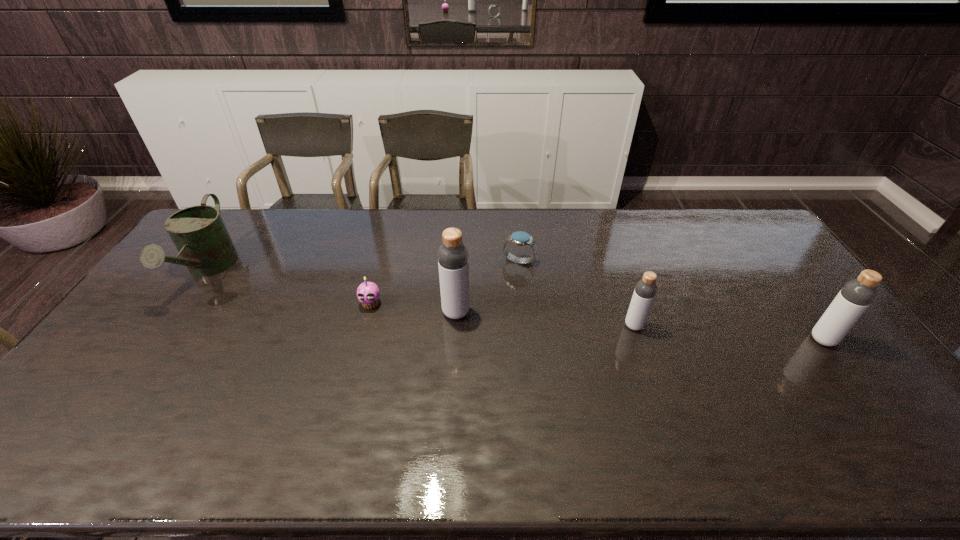
Please point a spot on the left to add another bottle. Please provide its 2D coordinates. Your answer should be formatted as a tuple, i.e. [(x, y)], where the tuple contains the x and y coordinates of a point satisfying the conditions above.

[(289, 300)]